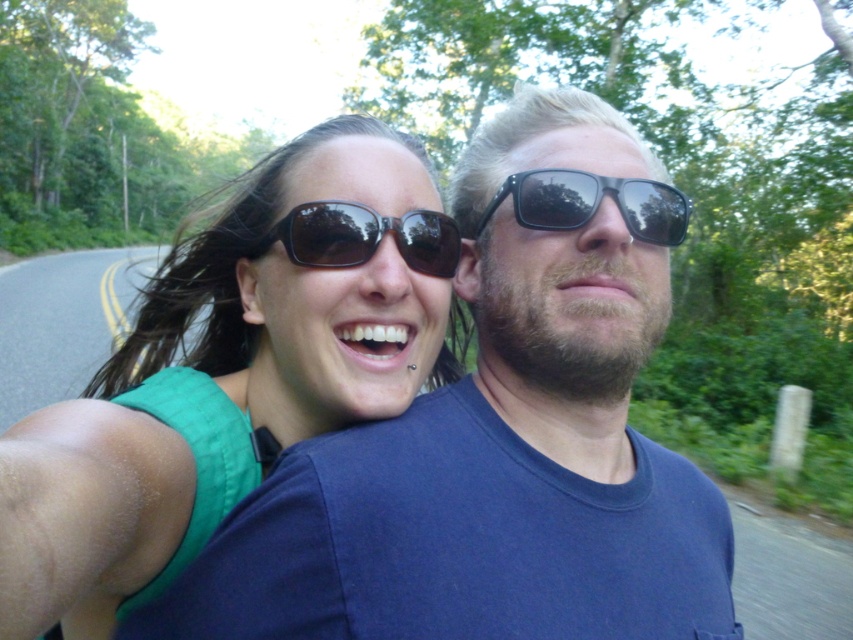
Question: Which point is closer to the camera?

Choices:
 (A) (495, 481)
 (B) (433, 225)
 (C) (86, 468)

Answer: (C)

Question: Which point is farther to the camera?

Choices:
 (A) (578, 177)
 (B) (62, 483)
 (C) (643, 317)
 (D) (440, 275)

Answer: (D)

Question: Does blue matte shirt at center appear on the left side of black reflective sunglasses at upper center?

Choices:
 (A) yes
 (B) no

Answer: (B)

Question: Is blue matte shirt at center positioned behind green fabric top at upper left?

Choices:
 (A) yes
 (B) no

Answer: (A)

Question: Does blue matte shirt at center appear under black reflective sunglasses at upper center?

Choices:
 (A) yes
 (B) no

Answer: (A)

Question: Which of the following is the closest to the observer?

Choices:
 (A) (550, 180)
 (B) (173, 464)
 (C) (260, 243)

Answer: (B)